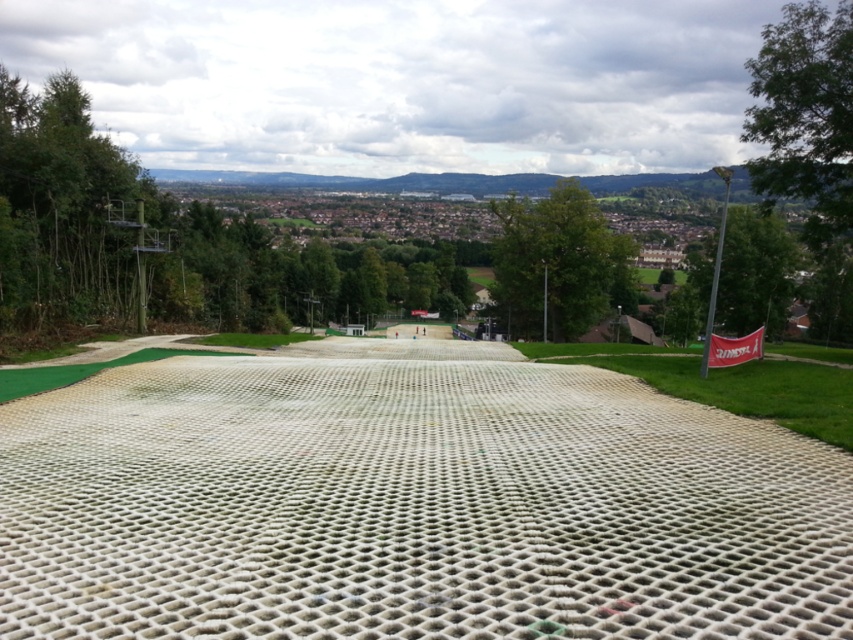
Can you confirm if white mesh dirt track at center is positioned to the right of white mesh golf course at center?

In fact, white mesh dirt track at center is to the left of white mesh golf course at center.

Does point (509, 360) come behind point (662, 364)?

Yes, point (509, 360) is behind point (662, 364).

Where is `white mesh dirt track at center`? Image resolution: width=853 pixels, height=640 pixels. white mesh dirt track at center is located at coordinates (410, 502).